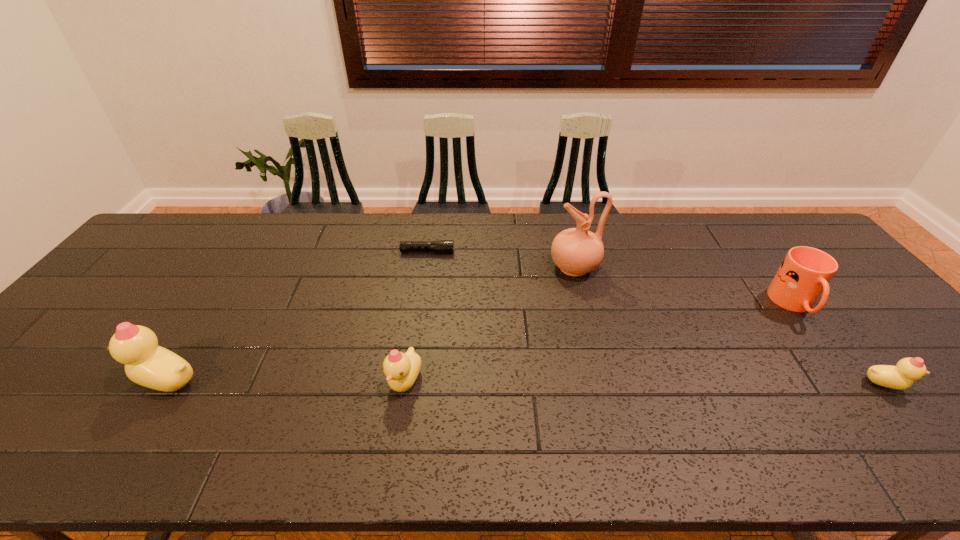
Locate an element on the screen. vacant space that's between the flashlight and the rightmost duckling is located at coordinates (657, 318).

Locate an element on the screen. blank region between the second tallest duckling and the second shortest object is located at coordinates (645, 383).

Find the location of `free space between the leftmost object and the pottery`. free space between the leftmost object and the pottery is located at coordinates (371, 323).

The height and width of the screenshot is (540, 960). Find the location of `empty space between the leftmost object and the fourth nearest object`. empty space between the leftmost object and the fourth nearest object is located at coordinates (481, 342).

Where is `vacant area that lies between the tallest object and the shortest object`? vacant area that lies between the tallest object and the shortest object is located at coordinates (501, 260).

Locate an element on the screen. Image resolution: width=960 pixels, height=540 pixels. empty space between the second shortest duckling and the leftmost object is located at coordinates (286, 381).

Find the location of `empty space between the pottery and the tallest duckling`. empty space between the pottery and the tallest duckling is located at coordinates tap(371, 323).

Find the location of a particular element. Image resolution: width=960 pixels, height=540 pixels. free space that is in between the fourth nearest object and the second tallest object is located at coordinates (481, 342).

Find the location of a particular element. object that stands as the second closest to the shortest object is located at coordinates (402, 369).

Identify the location of object that is the closest to the leftmost object. (402, 369).